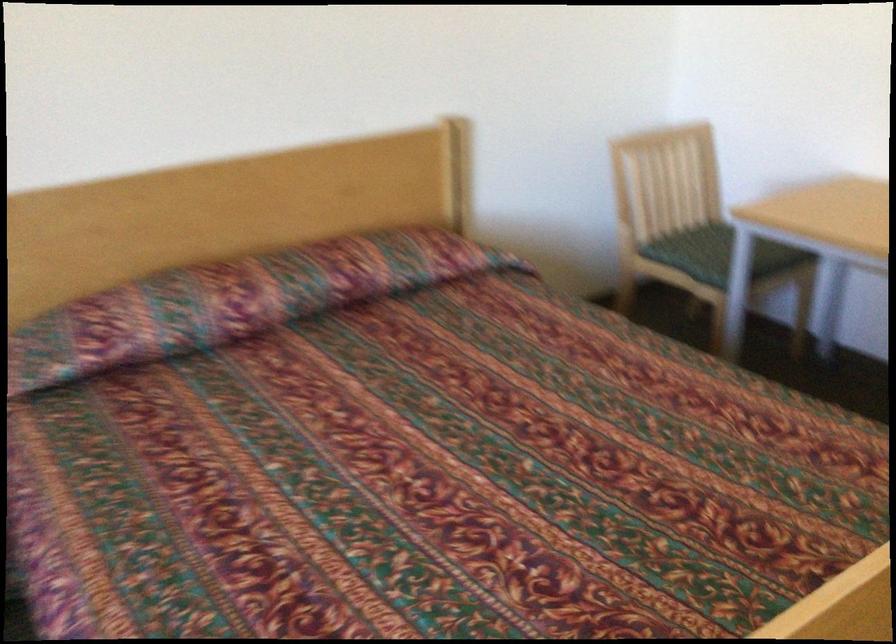
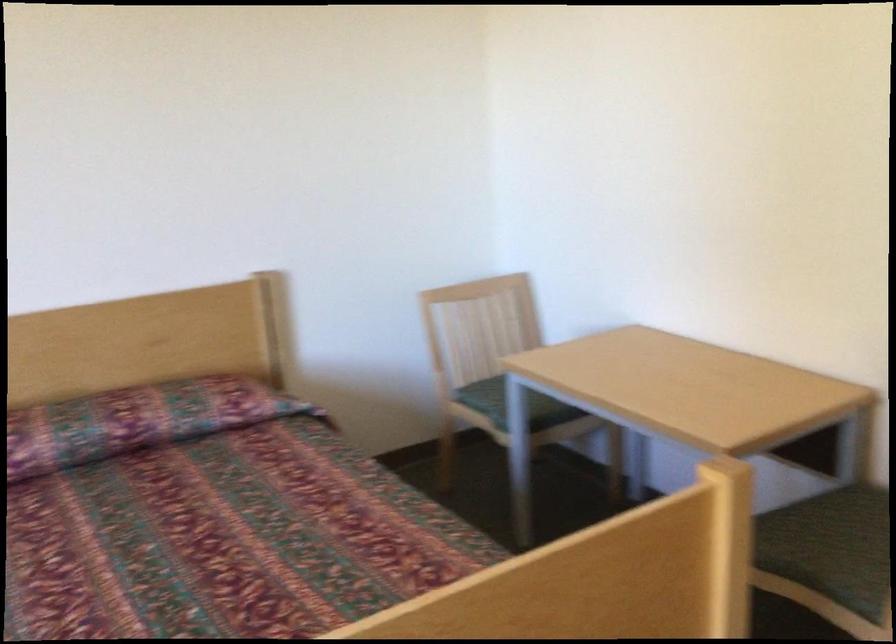
Question: What movement of the cameraman would produce the second image?

Choices:
 (A) Left
 (B) Right
 (C) Forward
 (D) Backward

Answer: (B)